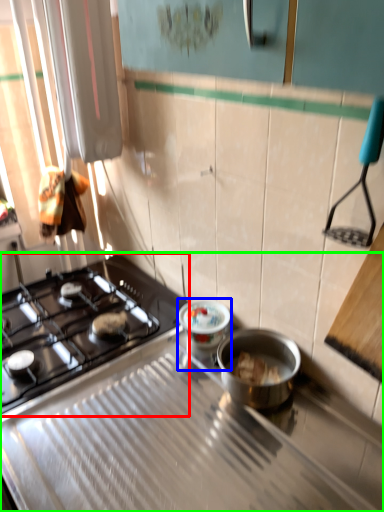
Question: Which is farther away from gas stove (highlighted by a red box)? appliance (highlighted by a blue box) or gas stove (highlighted by a green box)?

Choices:
 (A) appliance
 (B) gas stove

Answer: (A)